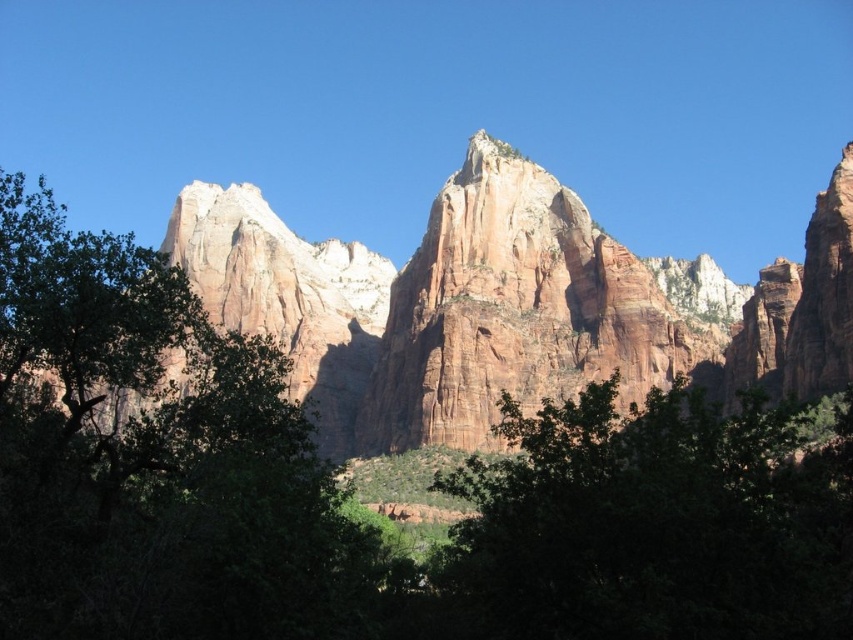
You are standing at the center of the scene. Which direction should you walk to reach the green leafy tree at left?

The green leafy tree at left is located to your left side, so you should walk towards the left to reach it.

You are a hiker standing at the base of the rustic sandstone cliff at center and want to take a photo of it. However, there is a green leafy tree at left blocking your view. Can you move to the right side of the tree to get an unobstructed view of the cliff?

The green leafy tree at left is in front of the rustic sandstone cliff at center. Moving to the right side of the tree might allow you to see around it, but since the tree is blocking the cliff, you may still have partial obstruction. Alternatively, moving further back could provide a clearer view without the tree in the way.

You are standing at the base of the large cliff and want to take a photo of the green leafy tree at left. If your camera has a maximum focus range of 150 feet, will it be able to focus on the tree?

The green leafy tree at left and camera are 168.26 feet apart from each other. Since the distance exceeds the camera maximum focus range of 150 feet, the camera cannot focus on the tree.